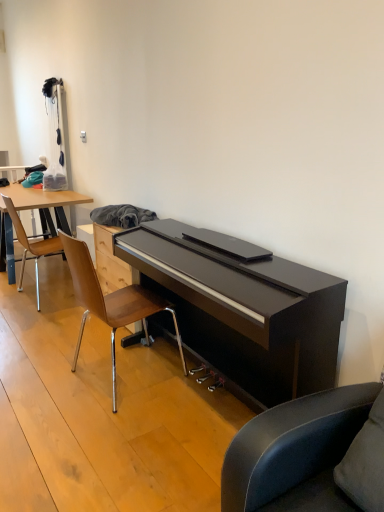
Identify the location of free location in front of wooden/metallic chair at center, which appears as the 1th chair when viewed from the front. The image size is (384, 512). (97, 448).